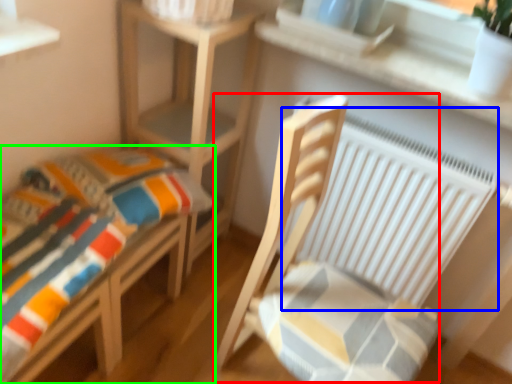
Question: Based on their relative distances, which object is farther from rocking chair (highlighted by a red box)? Choose from radiator (highlighted by a blue box) and furniture (highlighted by a green box).

Choices:
 (A) radiator
 (B) furniture

Answer: (B)